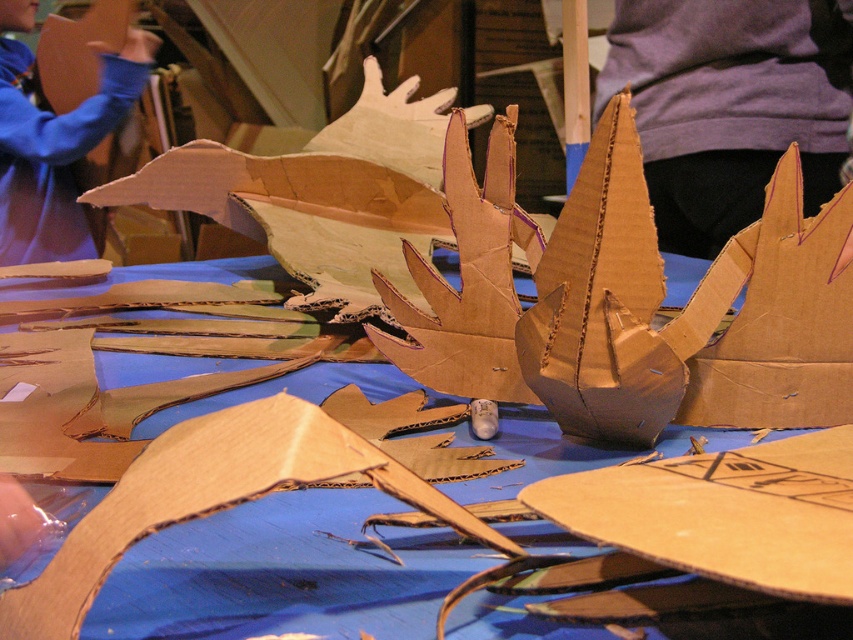
You are an assistant helping to assemble the dragon structure. You notice the cardboard pieces at center and the matte blue sweatshirt at upper left. Which object takes up more space in the workspace?

The cardboard pieces at center take up more space in the workspace because they are larger in size than the matte blue sweatshirt at upper left.

You are trying to assemble a dragon structure using the cardboard pieces at center and the cardboard at center. Which one has a greater width?

The cardboard pieces at center might be wider than cardboard at center.